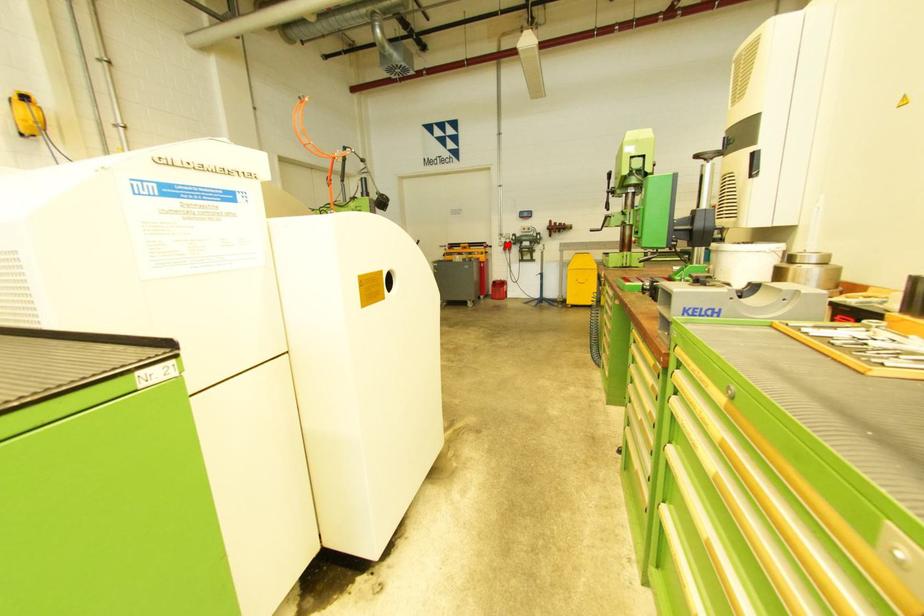
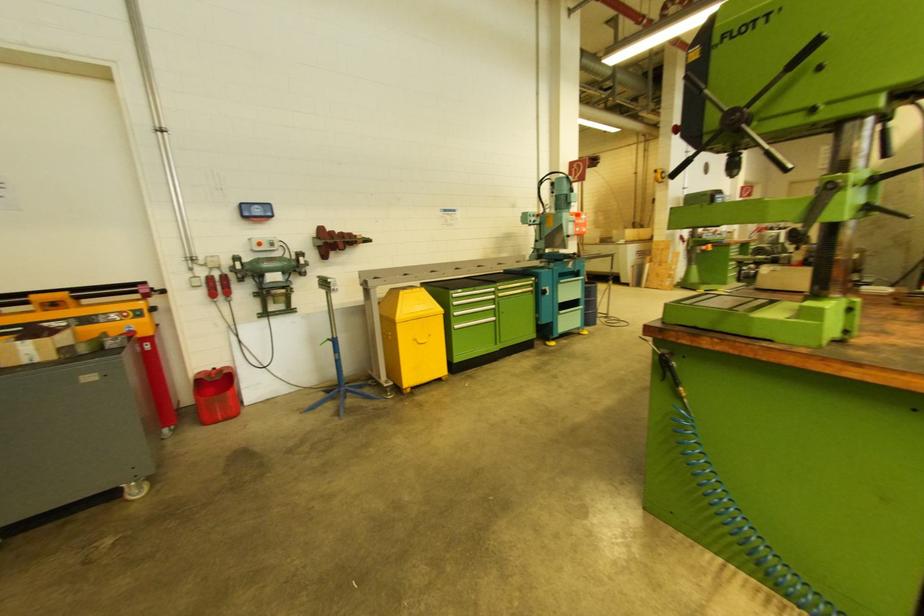
Question: I am providing you with two images of the same scene from different viewpoints. Image1 has a red point marked. In image2, the corresponding 3D location appears at what relative position? Reply with the corresponding letter.

Choices:
 (A) Closer
 (B) Farther

Answer: (B)